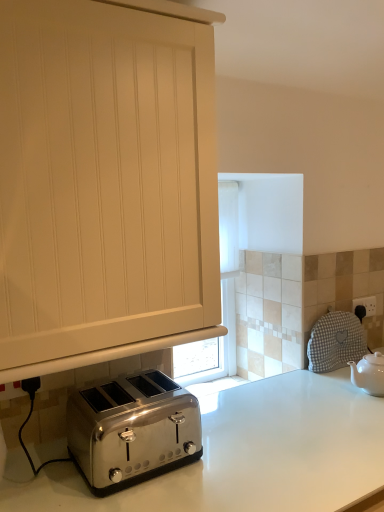
You are a GUI agent. You are given a task and a screenshot of the screen. Output one action in this format:
    pyautogui.click(x=<x>, y=<y>)
    Task: Click on the free space between satin silver toaster at lower left and white ceramic teapot at right
    
    Given the screenshot: What is the action you would take?
    pyautogui.click(x=275, y=416)